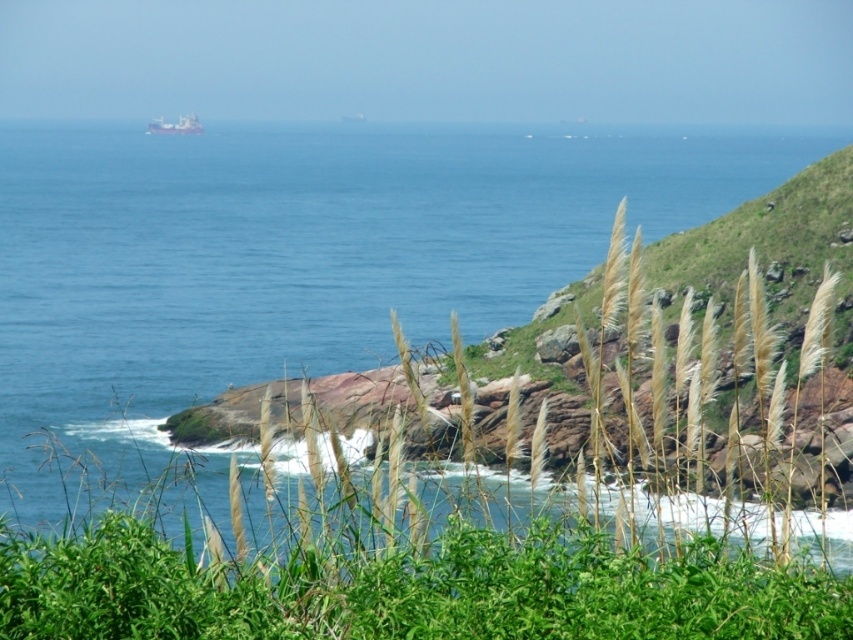
Question: Does blue water at center have a smaller size compared to metallic gray ship at upper center?

Choices:
 (A) yes
 (B) no

Answer: (B)

Question: Among these points, which one is nearest to the camera?

Choices:
 (A) (352, 349)
 (B) (193, 122)

Answer: (A)

Question: Which point is closer to the camera?

Choices:
 (A) metallic gray ship at upper center
 (B) blue water at center

Answer: (B)

Question: Where is blue water at center located in relation to metallic gray ship at upper center in the image?

Choices:
 (A) below
 (B) above

Answer: (A)

Question: Does blue water at center appear on the left side of metallic gray ship at upper center?

Choices:
 (A) no
 (B) yes

Answer: (A)